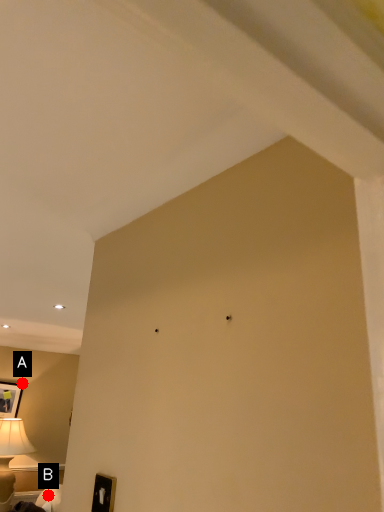
Question: Two points are circled on the image, labeled by A and B beside each circle. Which point is closer to the camera?

Choices:
 (A) A is closer
 (B) B is closer

Answer: (B)